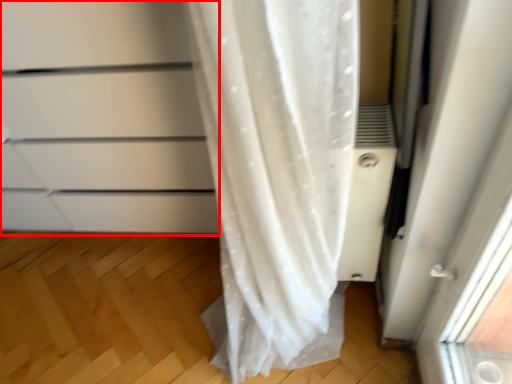
Question: From the image, what is the correct spatial relationship of cabinetry (annotated by the red box) in relation to air conditioner?

Choices:
 (A) right
 (B) left

Answer: (B)